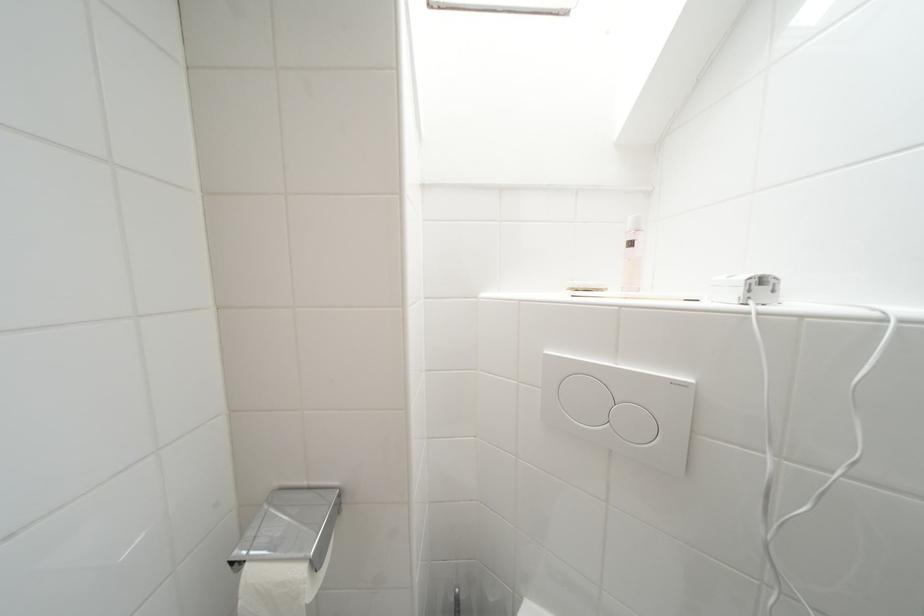
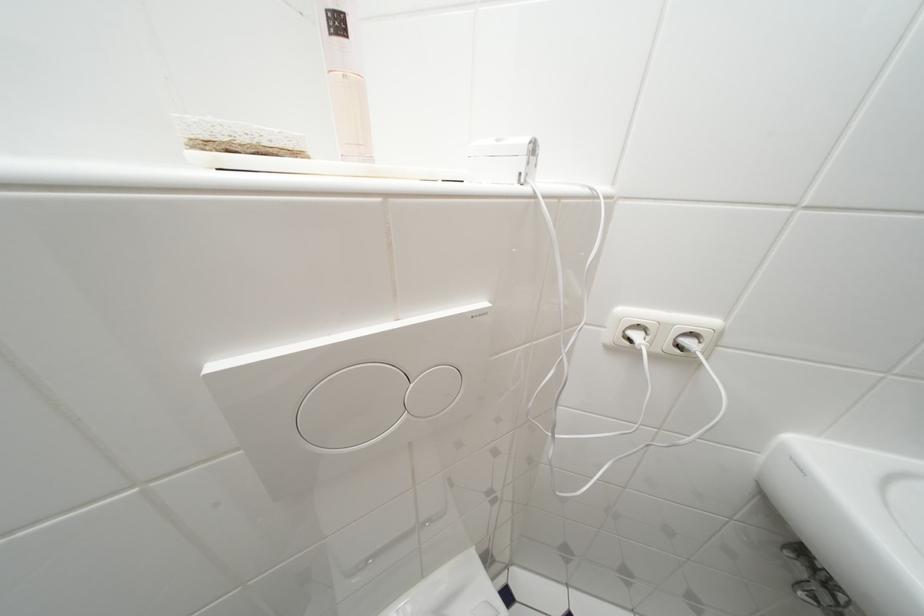
Locate, in the second image, the point that corresponds to pixel 638 246 in the first image.

(345, 26)